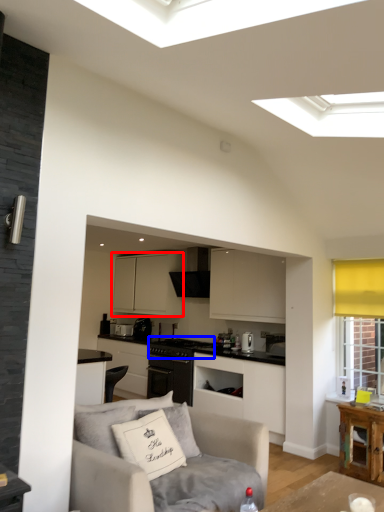
Question: Which object appears closest to the camera in this image, cabinetry (highlighted by a red box) or appliance (highlighted by a blue box)?

Choices:
 (A) cabinetry
 (B) appliance

Answer: (B)